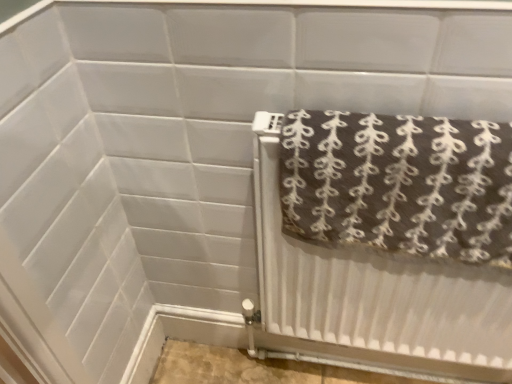
Question: Should I look upward or downward to see brown textured towel at right?

Choices:
 (A) up
 (B) down

Answer: (A)